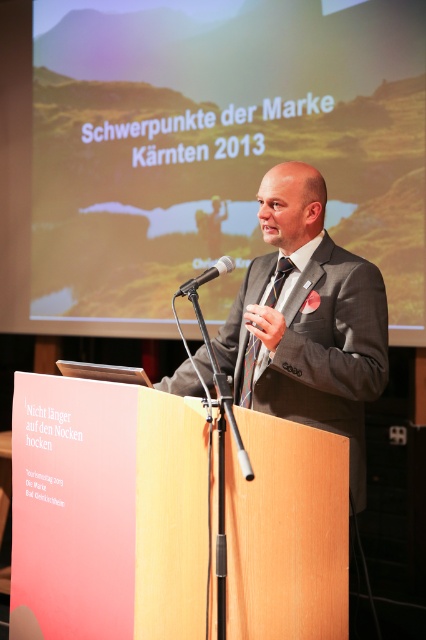
You are a stagehand setting up a presentation. You need to ensure there is enough space between the matte black suit at center and the black plastic microphone at center for the presenter to move comfortably. The recommended minimum distance is 16 inches. Is the current distance sufficient?

The matte black suit at center is 17.32 inches away from the black plastic microphone at center, which is greater than the recommended minimum distance of 16 inches. Therefore, the current distance is sufficient for the presenter to move comfortably.

You are a photographer taking a photo of the scene. You need to focus on the matte black suit at center and the black plastic microphone at center. Which object should you focus on first to ensure both are in sharp focus?

You should focus on the matte black suit at center first because it is closer to you than the black plastic microphone at center, ensuring both objects will be in focus when using proper depth of field.